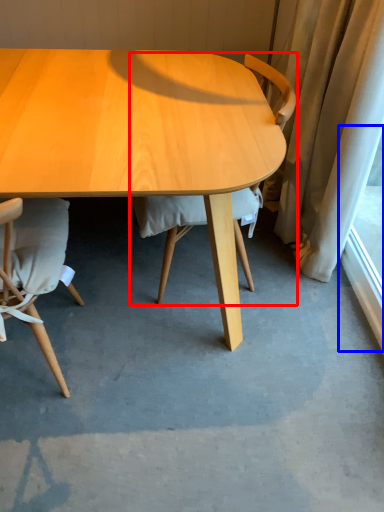
Question: Which object is closer to the camera taking this photo, chair (highlighted by a red box) or window screen (highlighted by a blue box)?

Choices:
 (A) chair
 (B) window screen

Answer: (A)